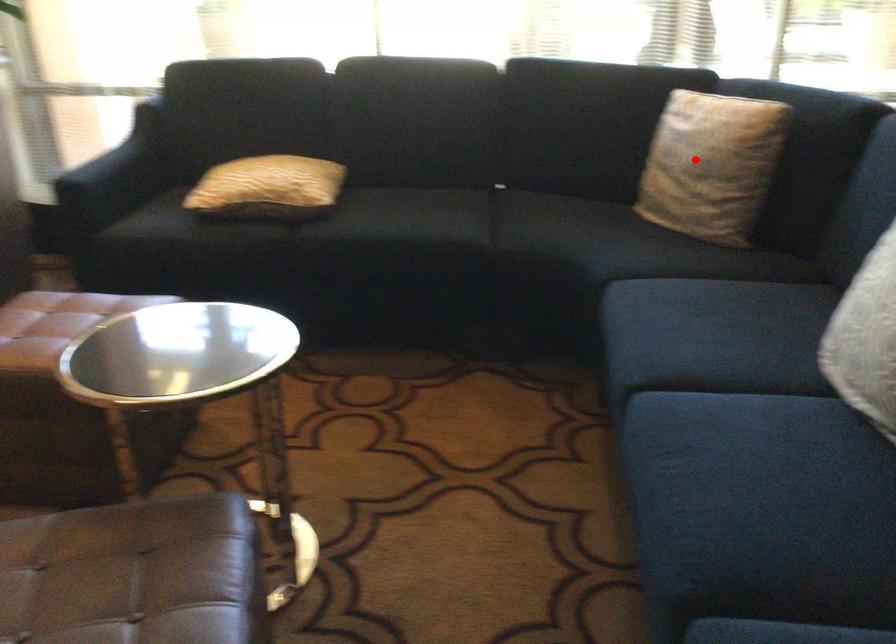
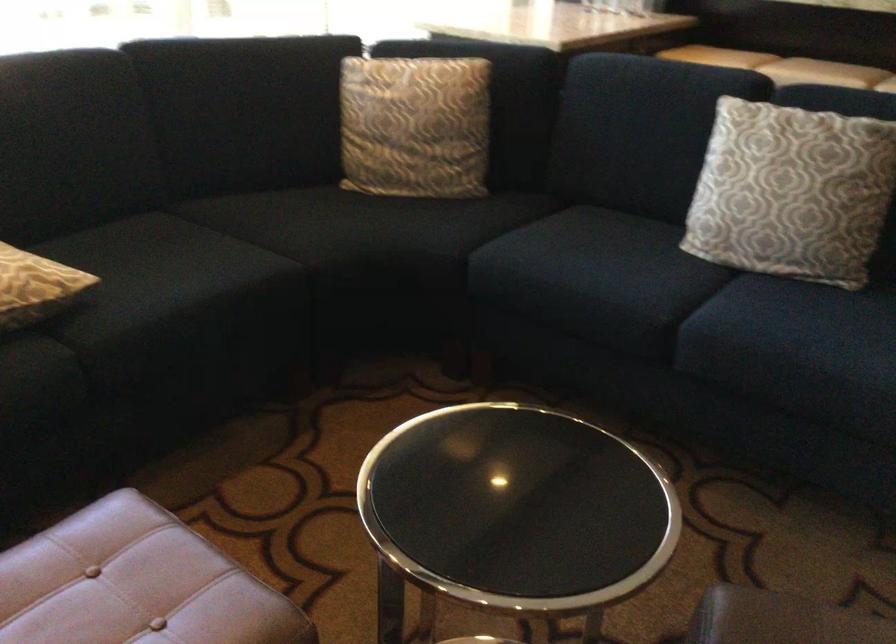
Locate, in the second image, the point that corresponds to the highlighted location in the first image.

(415, 126)